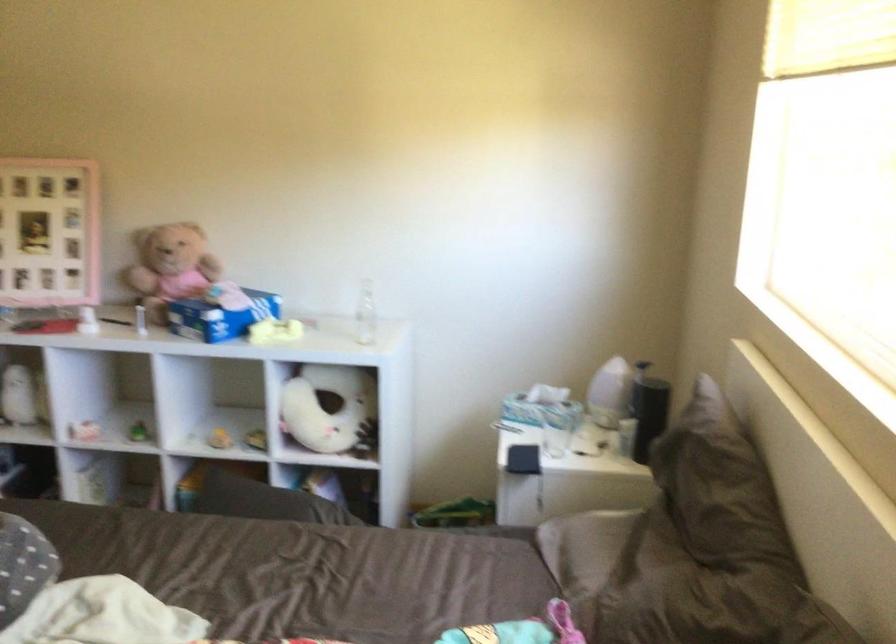
Which object does [522,459] point to?

It corresponds to the black rectangular object in the image.